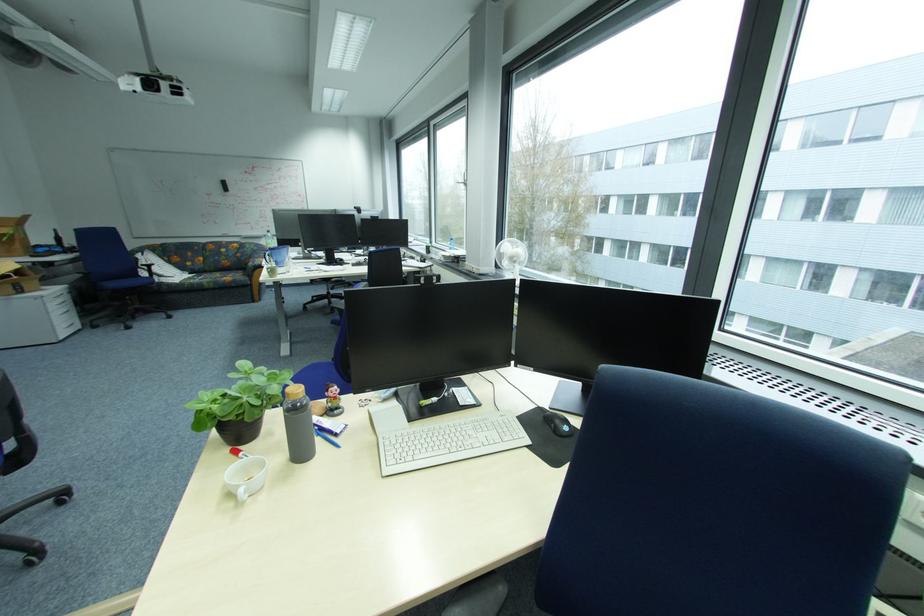
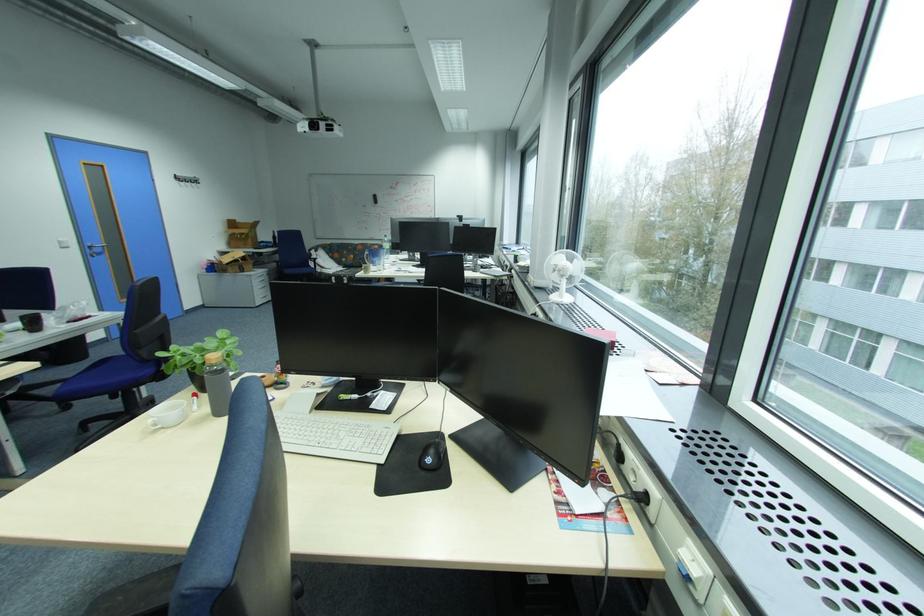
Question: In a continuous first-person perspective shot, in which direction is the camera moving?

Choices:
 (A) Left
 (B) Right
 (C) Forward
 (D) Backward

Answer: (B)